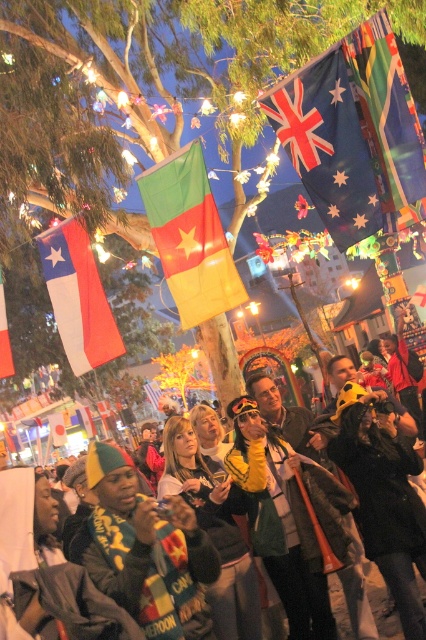
Is white fabric flag at left bigger than white fabric flag at center?

Yes, white fabric flag at left is bigger than white fabric flag at center.

Where is `white fabric flag at left`? white fabric flag at left is located at coordinates (77, 296).

The height and width of the screenshot is (640, 426). I want to click on white fabric flag at left, so click(x=77, y=296).

Who is more distant from viewer, (176,230) or (360,42)?

The point (176,230) is behind.

Is green fabric flag at center positioned before multicolored fabric flag at upper center?

No, it is behind multicolored fabric flag at upper center.

Is point (219, 272) in front of point (423, 205)?

That is False.

You are a GUI agent. You are given a task and a screenshot of the screen. Output one action in this format:
    pyautogui.click(x=<x>, y=<y>)
    Task: Click on the green fabric flag at center
    The height and width of the screenshot is (640, 426).
    Given the screenshot: What is the action you would take?
    pyautogui.click(x=189, y=236)

Does multicolored fabric flag at upper center lie in front of white fabric flag at center?

That is True.

Which is below, multicolored fabric flag at upper center or white fabric flag at center?

white fabric flag at center is lower down.

The width and height of the screenshot is (426, 640). What do you see at coordinates (388, 120) in the screenshot?
I see `multicolored fabric flag at upper center` at bounding box center [388, 120].

I want to click on multicolored fabric flag at upper center, so click(388, 120).